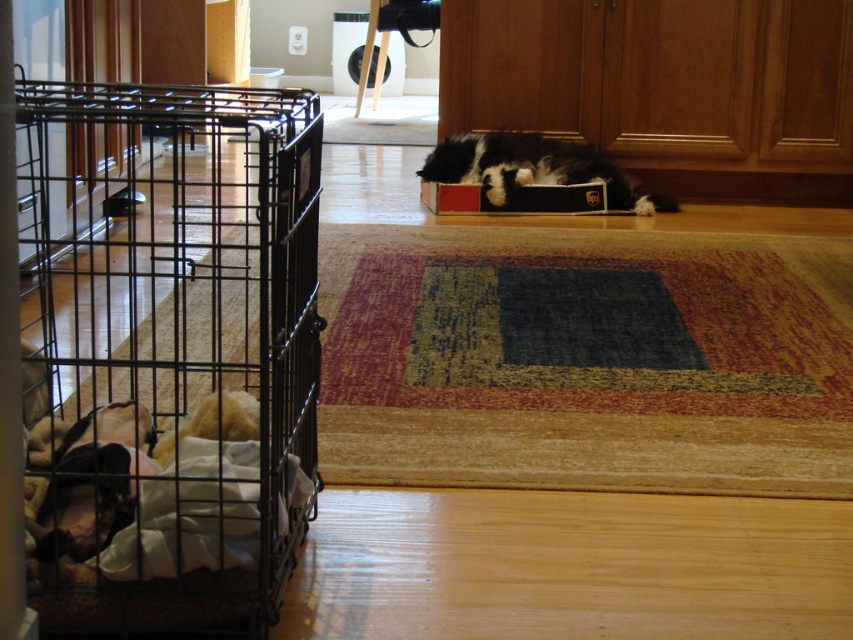
Question: Does black wire cage at left come in front of red cardboard box at center?

Choices:
 (A) yes
 (B) no

Answer: (A)

Question: Which point is closer to the camera?

Choices:
 (A) black wire cage at left
 (B) black and white fur cat at center
 (C) red cardboard box at center

Answer: (A)

Question: Is black wire cage at left behind red cardboard box at center?

Choices:
 (A) yes
 (B) no

Answer: (B)

Question: Can you confirm if black and white fur cat at center is bigger than red cardboard box at center?

Choices:
 (A) no
 (B) yes

Answer: (B)

Question: Which point appears closest to the camera in this image?

Choices:
 (A) (469, 157)
 (B) (426, 198)

Answer: (A)

Question: Based on their relative distances, which object is farther from the black wire cage at left?

Choices:
 (A) red cardboard box at center
 (B) black and white fur cat at center

Answer: (A)